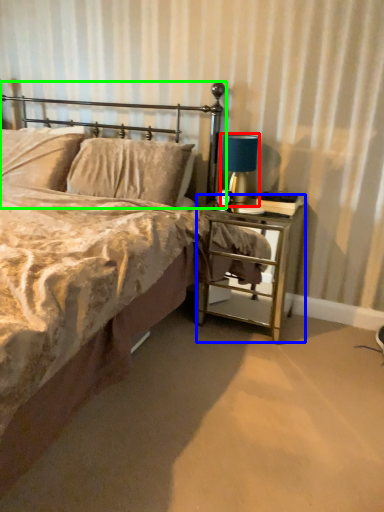
Question: Which object is positioned farthest from bedside lamp (highlighted by a red box)? Select from nightstand (highlighted by a blue box) and headboard (highlighted by a green box).

Choices:
 (A) nightstand
 (B) headboard

Answer: (A)